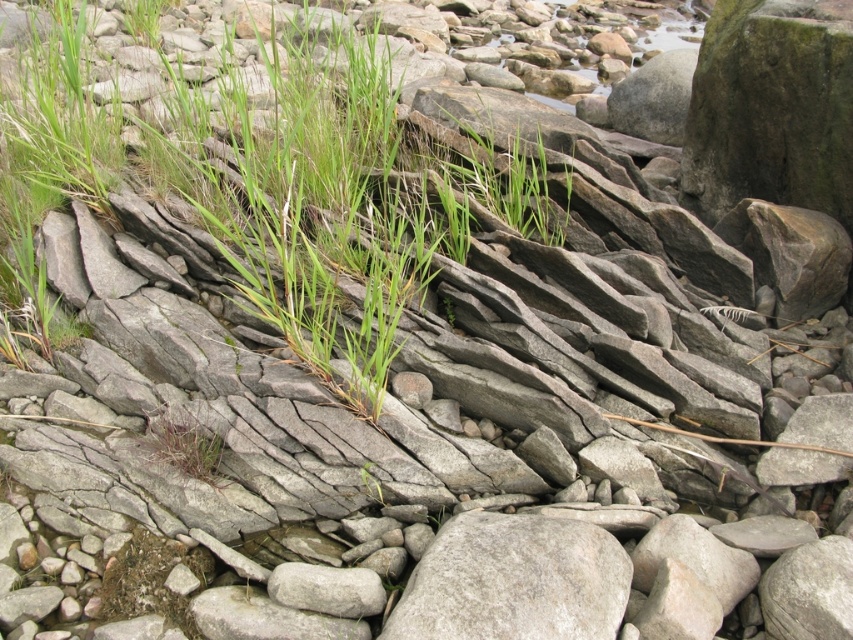
Question: Which object appears closest to the camera in this image?

Choices:
 (A) gray rough rock at center
 (B) green grass at center

Answer: (A)

Question: Does gray rough rock at center have a larger size compared to green grass at center?

Choices:
 (A) yes
 (B) no

Answer: (A)

Question: Is gray rough rock at center thinner than green grass at center?

Choices:
 (A) no
 (B) yes

Answer: (A)

Question: Is gray rough rock at center above green grass at center?

Choices:
 (A) no
 (B) yes

Answer: (A)

Question: Which point appears farthest from the camera in this image?

Choices:
 (A) (207, 474)
 (B) (460, 557)

Answer: (A)